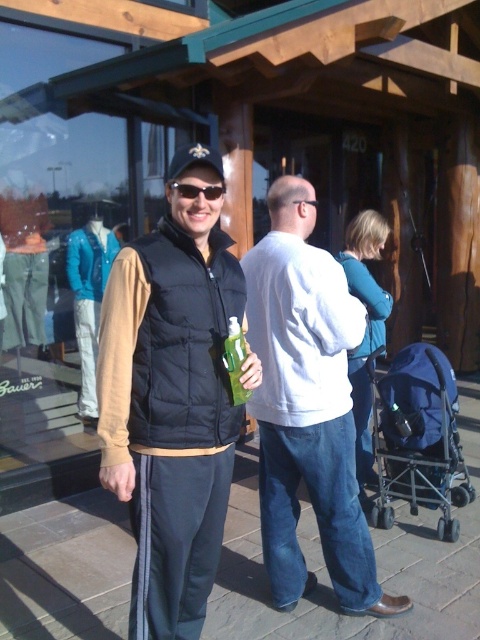
Looking at the scene outside the wooden building, there are two people wearing the white cotton shirt at center and the teal sweater at center. Which one is taller?

The white cotton shirt at center is taller than the teal sweater at center.

You are a photographer setting up for a group photo. You need to position the blue fabric stroller at lower right and the teal sweater at center so they both fit in the frame. Given their sizes, which object requires more space to accommodate?

The teal sweater at center requires more space because it occupies more space than the blue fabric stroller at lower right.

Based on the photo, you are standing at point (369,259) and want to walk to point (252,365). Which direction should you move to get closer to your destination?

You should move towards the camera because point (252,365) is closer to the camera than point (369,259).